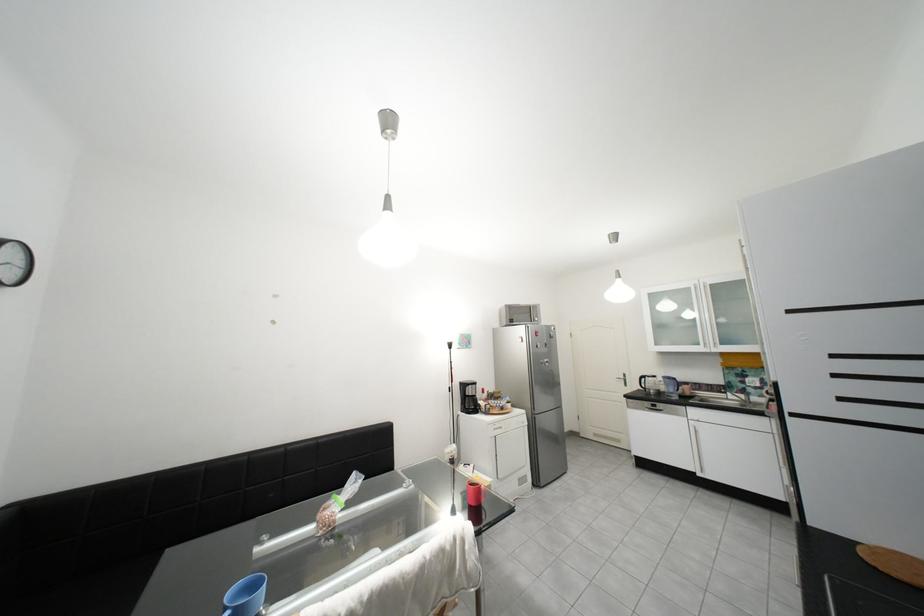
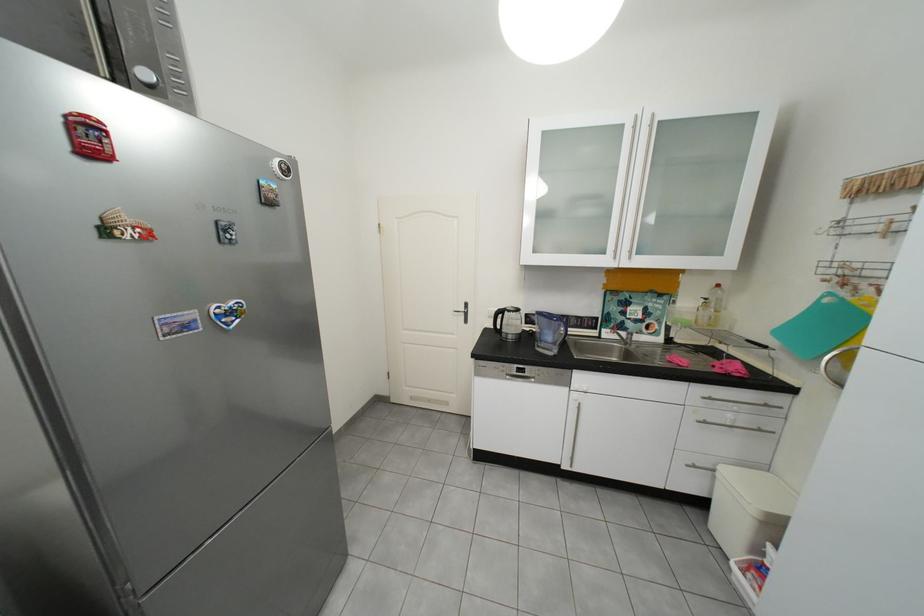
In the second image, find the point that corresponds to point 743,397 in the first image.

(619, 334)